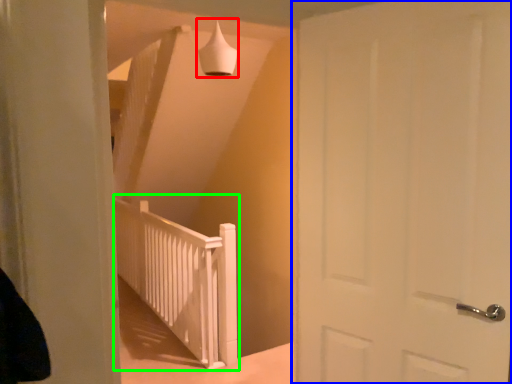
Question: Estimate the real-world distances between objects in this image. Which object is farther from lamp (highlighted by a red box), door (highlighted by a blue box) or rail (highlighted by a green box)?

Choices:
 (A) door
 (B) rail

Answer: (B)